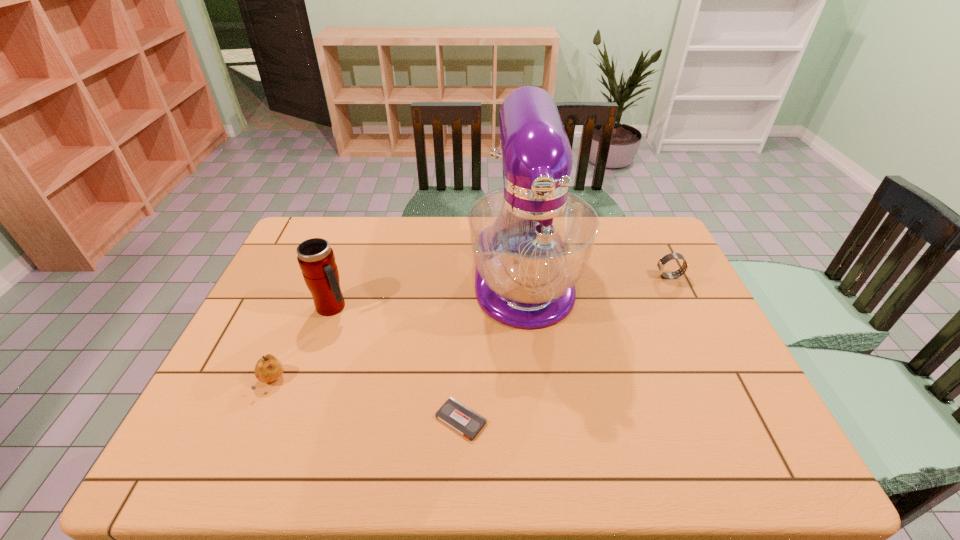
At what (x,y) coordinates should I click in order to perform the action: click on free spot between the second tallest object and the tallest object. Please return your answer as a coordinate pair (x, y). Looking at the image, I should click on (428, 292).

I want to click on free spot between the nearest object and the thermos bottle, so click(x=396, y=363).

This screenshot has height=540, width=960. In order to click on free space between the rightmost object and the nearest object in this screenshot , I will do `click(565, 348)`.

Locate an element on the screen. The height and width of the screenshot is (540, 960). unoccupied area between the pear and the rightmost object is located at coordinates pos(470,329).

Point out which object is positioned as the second nearest to the second nearest object. Please provide its 2D coordinates. Your answer should be formatted as a tuple, i.e. [(x, y)], where the tuple contains the x and y coordinates of a point satisfying the conditions above.

[(465, 421)]

You are a GUI agent. You are given a task and a screenshot of the screen. Output one action in this format:
    pyautogui.click(x=<x>, y=<y>)
    Task: Click on the object that ranks as the third closest to the mixer
    The height and width of the screenshot is (540, 960).
    Given the screenshot: What is the action you would take?
    pyautogui.click(x=316, y=259)

Image resolution: width=960 pixels, height=540 pixels. Find the location of `vacant space that satisfies the following two spatial constraints: 1. on the face of the rightmost object; 2. on the front side of the videotape`. vacant space that satisfies the following two spatial constraints: 1. on the face of the rightmost object; 2. on the front side of the videotape is located at coordinates (739, 420).

Where is `blank space that satisfies the following two spatial constraints: 1. on the side with the handle of the thermos bottle; 2. on the left side of the nearest object`? blank space that satisfies the following two spatial constraints: 1. on the side with the handle of the thermos bottle; 2. on the left side of the nearest object is located at coordinates (293, 420).

Where is `free space that satisfies the following two spatial constraints: 1. at the bowl opening of the mixer; 2. on the side with the handle of the thermos bottle`? Image resolution: width=960 pixels, height=540 pixels. free space that satisfies the following two spatial constraints: 1. at the bowl opening of the mixer; 2. on the side with the handle of the thermos bottle is located at coordinates (527, 307).

This screenshot has width=960, height=540. I want to click on free location that satisfies the following two spatial constraints: 1. on the side with the handle of the fourth shortest object; 2. on the back side of the nearest object, so pos(293,420).